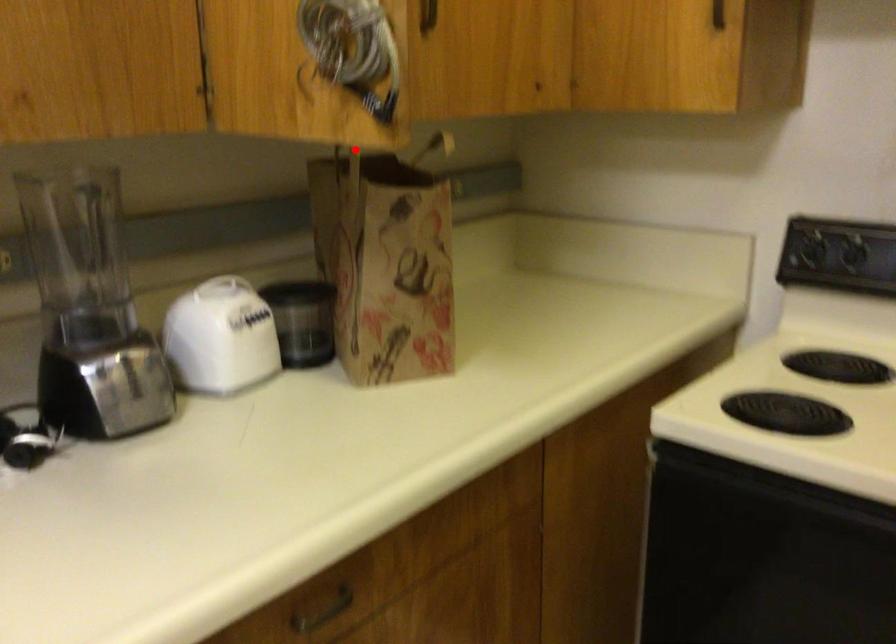
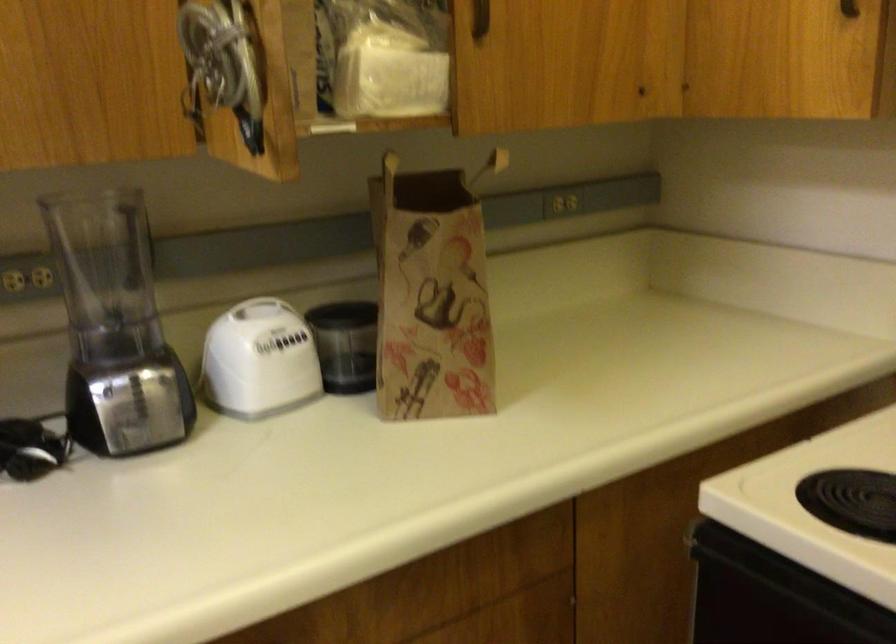
Locate, in the second image, the point that corresponds to the highlighted location in the first image.

(389, 163)